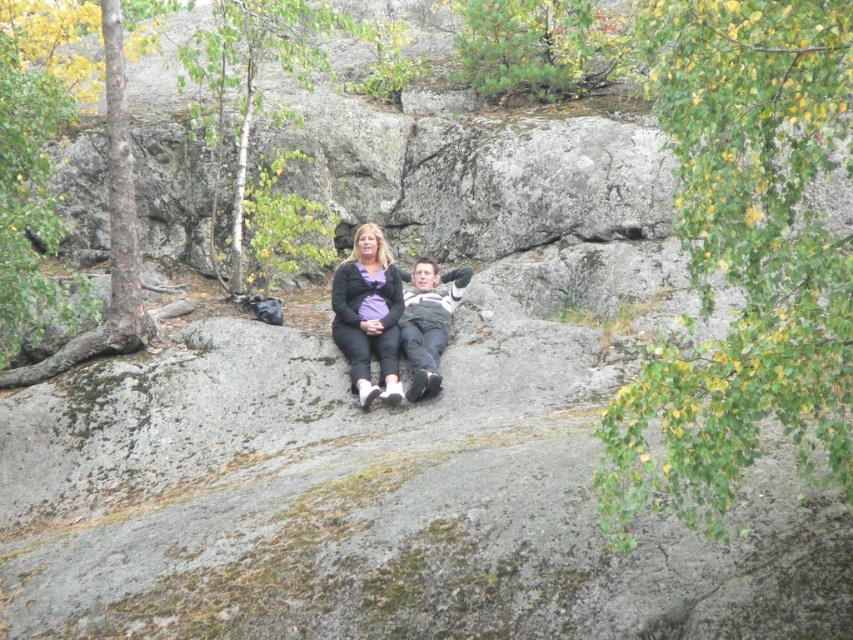
Which is below, matte black sweater at center or matte gray sweater at center?

matte gray sweater at center is lower down.

Where is `matte black sweater at center`? matte black sweater at center is located at coordinates (368, 314).

Find the location of a particular element. This screenshot has height=640, width=853. matte black sweater at center is located at coordinates (368, 314).

Does green leafy branch at upper right appear over matte gray sweater at center?

Indeed, green leafy branch at upper right is positioned over matte gray sweater at center.

Who is taller, green leafy branch at upper right or matte gray sweater at center?

green leafy branch at upper right

What do you see at coordinates (743, 253) in the screenshot? The image size is (853, 640). I see `green leafy branch at upper right` at bounding box center [743, 253].

Where is `green leafy branch at upper right`? This screenshot has height=640, width=853. green leafy branch at upper right is located at coordinates (743, 253).

Who is taller, green rough bark tree at left or matte gray sweater at center?

green rough bark tree at left is taller.

Describe the element at coordinates (109, 230) in the screenshot. I see `green rough bark tree at left` at that location.

At what (x,y) coordinates should I click in order to perform the action: click on green rough bark tree at left. Please return your answer as a coordinate pair (x, y). Looking at the image, I should click on coord(109,230).